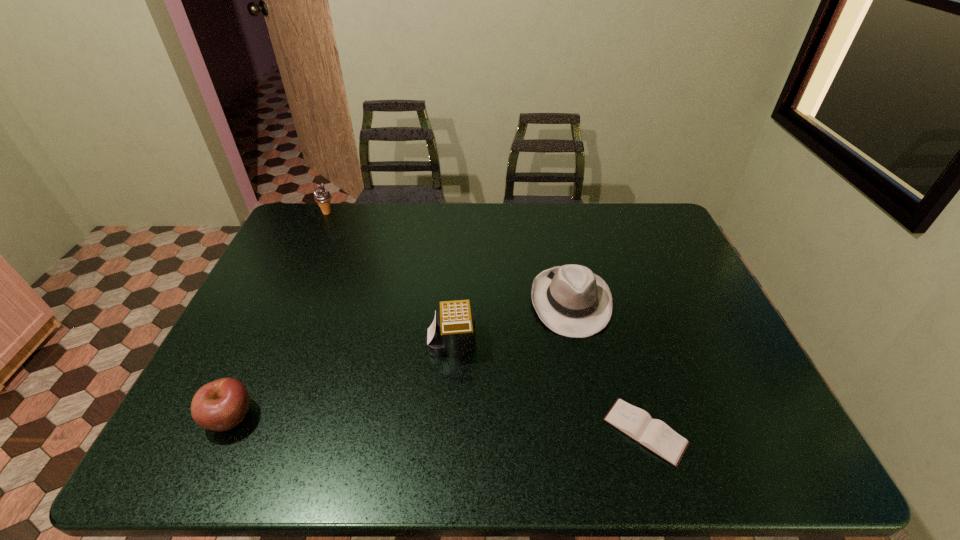
Find the location of a particular element. free point between the farthest object and the shortest object is located at coordinates (486, 322).

At what (x,y) coordinates should I click in order to perform the action: click on vacant point located between the third object from left to right and the apple. Please return your answer as a coordinate pair (x, y). The height and width of the screenshot is (540, 960). Looking at the image, I should click on pos(341,380).

Point out which object is positioned as the second nearest to the fedora. Please provide its 2D coordinates. Your answer should be formatted as a tuple, i.e. [(x, y)], where the tuple contains the x and y coordinates of a point satisfying the conditions above.

[(655, 435)]

At what (x,y) coordinates should I click in order to perform the action: click on the closest object to the icecream. Please return your answer as a coordinate pair (x, y). This screenshot has height=540, width=960. Looking at the image, I should click on [452, 333].

Find the location of `vacant space that satisfies the following two spatial constraints: 1. on the front side of the third object from right to left; 2. on the left side of the shortest object`. vacant space that satisfies the following two spatial constraints: 1. on the front side of the third object from right to left; 2. on the left side of the shortest object is located at coordinates (445, 431).

Where is `free space that satisfies the following two spatial constraints: 1. on the front-facing side of the fedora; 2. on the left side of the diary`? This screenshot has height=540, width=960. free space that satisfies the following two spatial constraints: 1. on the front-facing side of the fedora; 2. on the left side of the diary is located at coordinates (598, 431).

Identify the location of vacant point that satisfies the following two spatial constraints: 1. on the side of the apple with the unique marking; 2. on the right side of the diary. The image size is (960, 540). (224, 431).

Identify the location of vacant area that satisfies the following two spatial constraints: 1. on the front side of the shortest object; 2. on the right side of the third object from left to right. Image resolution: width=960 pixels, height=540 pixels. (445, 431).